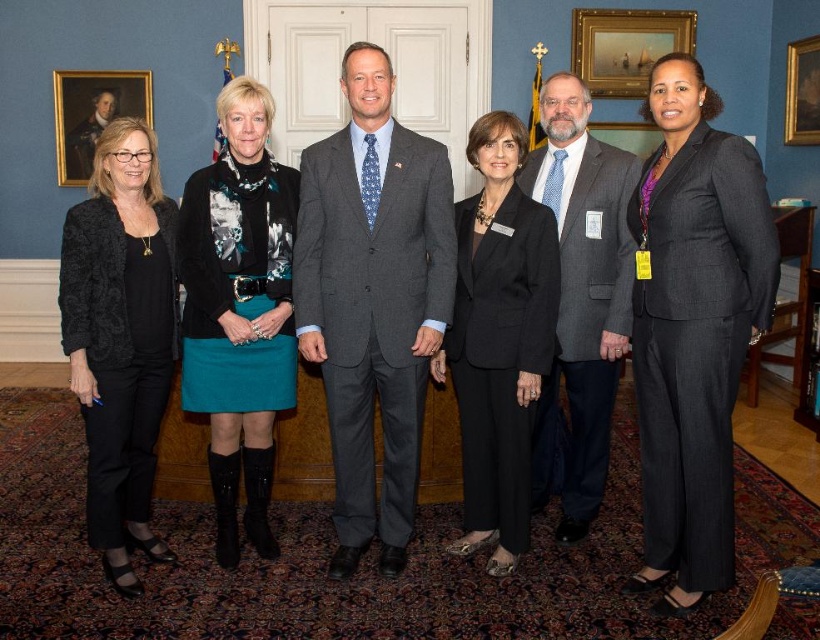
The width and height of the screenshot is (820, 640). What do you see at coordinates (121, 337) in the screenshot?
I see `black textured blazer at left` at bounding box center [121, 337].

Is black textured blazer at left taller than gray wool suit at center?

Incorrect, black textured blazer at left's height is not larger of gray wool suit at center's.

This screenshot has height=640, width=820. What do you see at coordinates (121, 337) in the screenshot?
I see `black textured blazer at left` at bounding box center [121, 337].

At what (x,y) coordinates should I click in order to perform the action: click on black textured blazer at left. Please return your answer as a coordinate pair (x, y). Looking at the image, I should click on (121, 337).

Between charcoal gray suit at right and black wool suit at center, which one has less height?

With less height is charcoal gray suit at right.

Which is below, charcoal gray suit at right or black wool suit at center?

charcoal gray suit at right is below.

Between point (727, 392) and point (525, 413), which one is positioned behind?

The point (525, 413) is behind.

In order to click on charcoal gray suit at right in this screenshot , I will do `click(697, 342)`.

Does teal skirt at center have a greater width compared to gray wool suit at center?

Yes.

Can you confirm if teal skirt at center is positioned below gray wool suit at center?

Correct, teal skirt at center is located below gray wool suit at center.

Does point (199, 193) come farther from viewer compared to point (607, 365)?

No, (199, 193) is in front of (607, 365).

The image size is (820, 640). Identify the location of teal skirt at center. (239, 308).